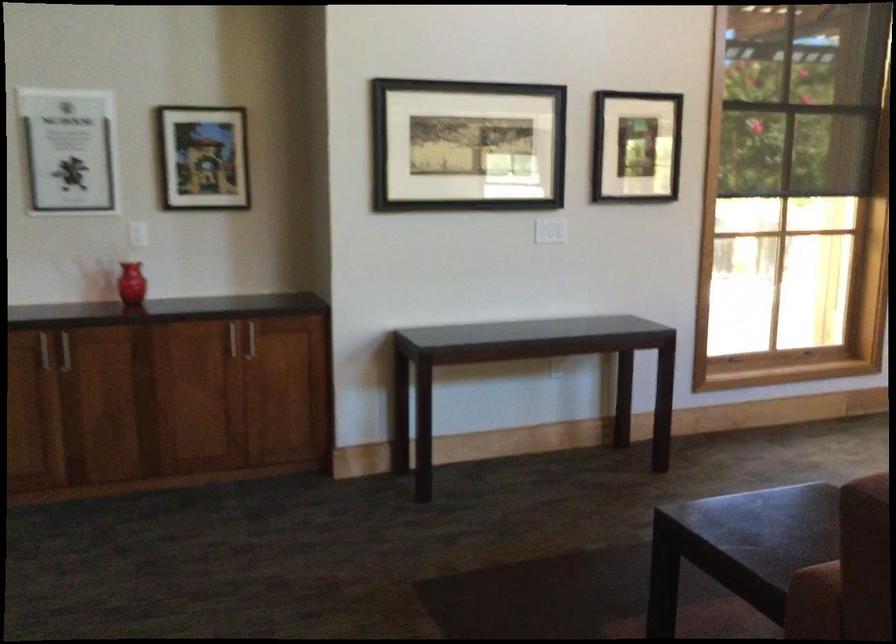
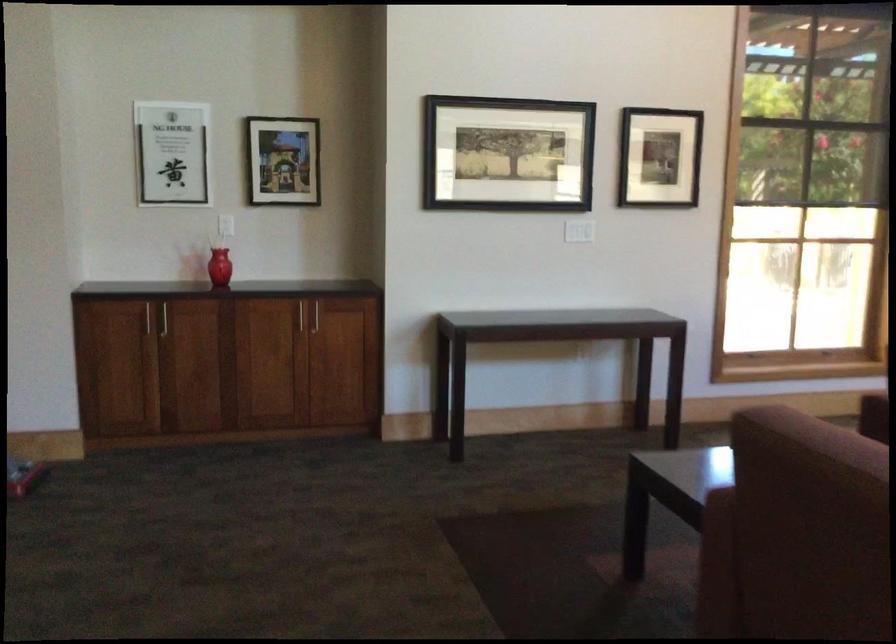
Question: The camera is either moving clockwise (left) or counter-clockwise (right) around the object. The first image is from the beginning of the video and the second image is from the end. Is the camera moving left or right when shooting the video?

Choices:
 (A) Left
 (B) Right

Answer: (B)